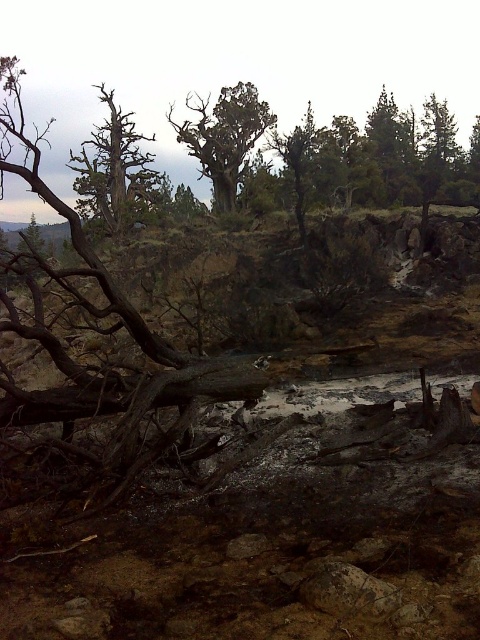
You are a park ranger assessing the safety of a hiking trail. You notice two objects in the left side of the scene, the dark brown wood at left and the dead wood at left. The trail is 10 meters wide. Can you determine if the two objects are positioned within the trail width?

The distance between the dark brown wood at left and the dead wood at left is 11.59 meters, which exceeds the trail width of 10 meters. Therefore, the two objects are positioned outside the trail width.

You are a park ranger assessing the forest. You need to determine which object has a greater width between the dead wood at left and the green textured tree at center. Which one is wider?

The dead wood at left is wider than the green textured tree at center according to the description.